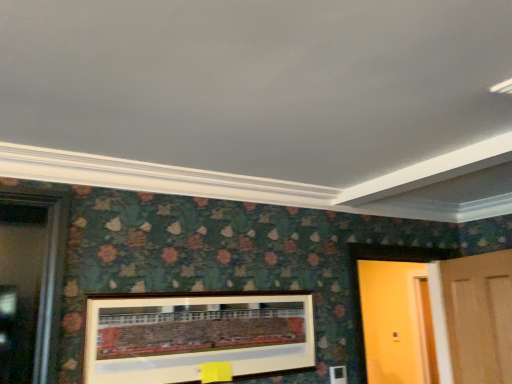
Question: Is wooden picture frame at center wider or thinner than wooden door at right, the 2th door in the right-to-left sequence?

Choices:
 (A) wide
 (B) thin

Answer: (B)

Question: From their relative heights in the image, would you say wooden picture frame at center is taller or shorter than wooden door at right, which is the first door in left-to-right order?

Choices:
 (A) tall
 (B) short

Answer: (B)

Question: Which of these objects is positioned closest to the wooden door at right, which is the first door in left-to-right order?

Choices:
 (A) wooden door at right, the second door positioned from the left
 (B) wooden picture frame at center

Answer: (A)

Question: Considering the real-world distances, which object is closest to the wooden picture frame at center?

Choices:
 (A) wooden door at right, which is the first door in left-to-right order
 (B) wooden door at right, the second door positioned from the left

Answer: (A)